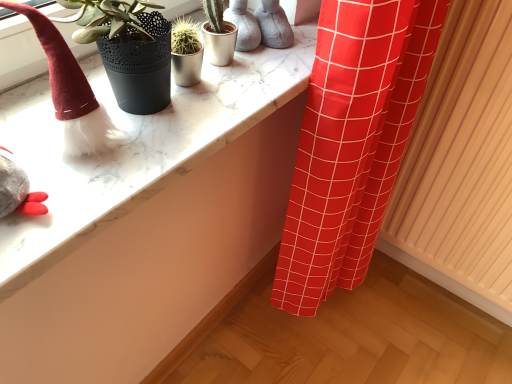
Question: Should I look upward or downward to see fuzzy red hat at left?

Choices:
 (A) down
 (B) up

Answer: (B)

Question: Does fuzzy red hat at left have a larger size compared to wooden radiator at right?

Choices:
 (A) yes
 (B) no

Answer: (B)

Question: From a real-world perspective, does fuzzy red hat at left stand above wooden radiator at right?

Choices:
 (A) no
 (B) yes

Answer: (B)

Question: Is fuzzy red hat at left looking in the opposite direction of wooden radiator at right?

Choices:
 (A) no
 (B) yes

Answer: (A)

Question: Is fuzzy red hat at left smaller than wooden radiator at right?

Choices:
 (A) yes
 (B) no

Answer: (A)

Question: Is the position of fuzzy red hat at left less distant than that of wooden radiator at right?

Choices:
 (A) no
 (B) yes

Answer: (B)

Question: Can you confirm if fuzzy red hat at left is shorter than wooden radiator at right?

Choices:
 (A) no
 (B) yes

Answer: (B)

Question: Considering the relative sizes of fuzzy red hat at left and marble counter top at upper left in the image provided, is fuzzy red hat at left bigger than marble counter top at upper left?

Choices:
 (A) yes
 (B) no

Answer: (B)

Question: Does fuzzy red hat at left appear on the right side of marble counter top at upper left?

Choices:
 (A) no
 (B) yes

Answer: (A)

Question: Is fuzzy red hat at left wider than marble counter top at upper left?

Choices:
 (A) yes
 (B) no

Answer: (B)

Question: Is fuzzy red hat at left touching marble counter top at upper left?

Choices:
 (A) yes
 (B) no

Answer: (B)

Question: Is the position of fuzzy red hat at left less distant than that of marble counter top at upper left?

Choices:
 (A) yes
 (B) no

Answer: (A)

Question: Could you tell me if fuzzy red hat at left is turned towards marble counter top at upper left?

Choices:
 (A) yes
 (B) no

Answer: (B)

Question: Is wooden radiator at right beside marble counter top at upper left?

Choices:
 (A) no
 (B) yes

Answer: (A)